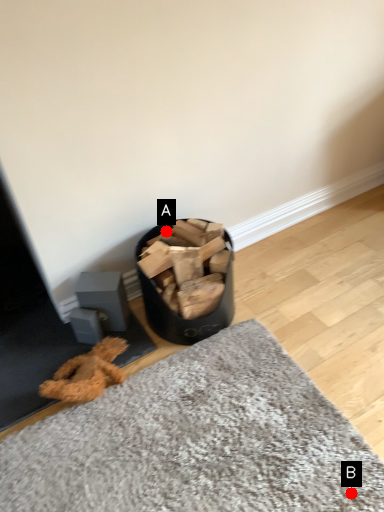
Question: Two points are circled on the image, labeled by A and B beside each circle. Among these points, which one is farthest from the camera?

Choices:
 (A) A is further
 (B) B is further

Answer: (A)